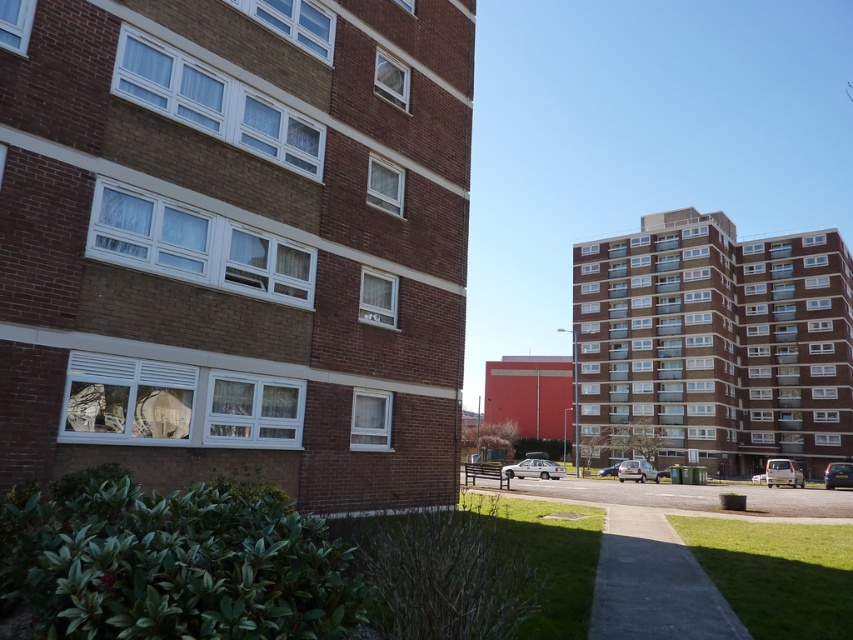
Question: Which object is closer to the camera taking this photo?

Choices:
 (A) silver metallic car at center
 (B) silver metallic sedan at center
 (C) dark blue metallic car at lower right

Answer: (B)

Question: Which object appears closest to the camera in this image?

Choices:
 (A) dark blue metallic car at lower right
 (B) metallic silver car at center
 (C) silver metallic car at center

Answer: (A)

Question: Can you confirm if silver metallic sedan at center is smaller than dark blue metallic car at lower right?

Choices:
 (A) yes
 (B) no

Answer: (B)

Question: Estimate the real-world distances between objects in this image. Which object is closer to the silver metallic car at center?

Choices:
 (A) metallic silver van at lower right
 (B) silver metallic sedan at center
 (C) metallic silver car at center

Answer: (B)

Question: Can you confirm if silver metallic car at center is bigger than dark blue metallic car at lower right?

Choices:
 (A) no
 (B) yes

Answer: (A)

Question: Is silver metallic car at center smaller than metallic silver car at center?

Choices:
 (A) no
 (B) yes

Answer: (A)